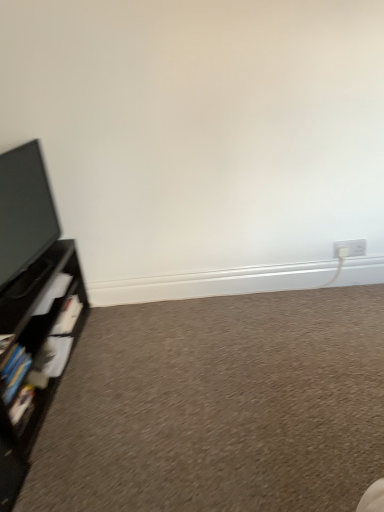
Question: From the image's perspective, is white plastic electric outlet at lower right on top of black matte shelf at left?

Choices:
 (A) no
 (B) yes

Answer: (B)

Question: From a real-world perspective, is white plastic electric outlet at lower right on black matte shelf at left?

Choices:
 (A) no
 (B) yes

Answer: (B)

Question: Considering the relative sizes of white plastic electric outlet at lower right and black matte shelf at left in the image provided, is white plastic electric outlet at lower right taller than black matte shelf at left?

Choices:
 (A) no
 (B) yes

Answer: (A)

Question: Is white plastic electric outlet at lower right facing towards black matte shelf at left?

Choices:
 (A) yes
 (B) no

Answer: (B)

Question: From a real-world perspective, is white plastic electric outlet at lower right beneath black matte shelf at left?

Choices:
 (A) yes
 (B) no

Answer: (B)

Question: Is carpet at lower left inside the boundaries of white plastic electric outlet at lower right, or outside?

Choices:
 (A) outside
 (B) inside

Answer: (A)

Question: In the image, is carpet at lower left on the left side or the right side of white plastic electric outlet at lower right?

Choices:
 (A) right
 (B) left

Answer: (B)

Question: Relative to white plastic electric outlet at lower right, is carpet at lower left in front or behind?

Choices:
 (A) front
 (B) behind

Answer: (A)

Question: In terms of width, does carpet at lower left look wider or thinner when compared to white plastic electric outlet at lower right?

Choices:
 (A) wide
 (B) thin

Answer: (A)

Question: In the image, is white plastic electric outlet at lower right on the left side or the right side of black matte shelf at left?

Choices:
 (A) left
 (B) right

Answer: (B)

Question: Considering the positions of white plastic electric outlet at lower right and black matte shelf at left in the image, is white plastic electric outlet at lower right wider or thinner than black matte shelf at left?

Choices:
 (A) wide
 (B) thin

Answer: (B)

Question: Relative to black matte shelf at left, is white plastic electric outlet at lower right in front or behind?

Choices:
 (A) front
 (B) behind

Answer: (B)

Question: Do you think white plastic electric outlet at lower right is within black matte shelf at left, or outside of it?

Choices:
 (A) inside
 (B) outside

Answer: (B)

Question: In the image, is black matte shelf at left on the left side or the right side of white plastic electric outlet at lower right?

Choices:
 (A) right
 (B) left

Answer: (B)

Question: From a real-world perspective, is black matte shelf at left above or below white plastic electric outlet at lower right?

Choices:
 (A) above
 (B) below

Answer: (B)